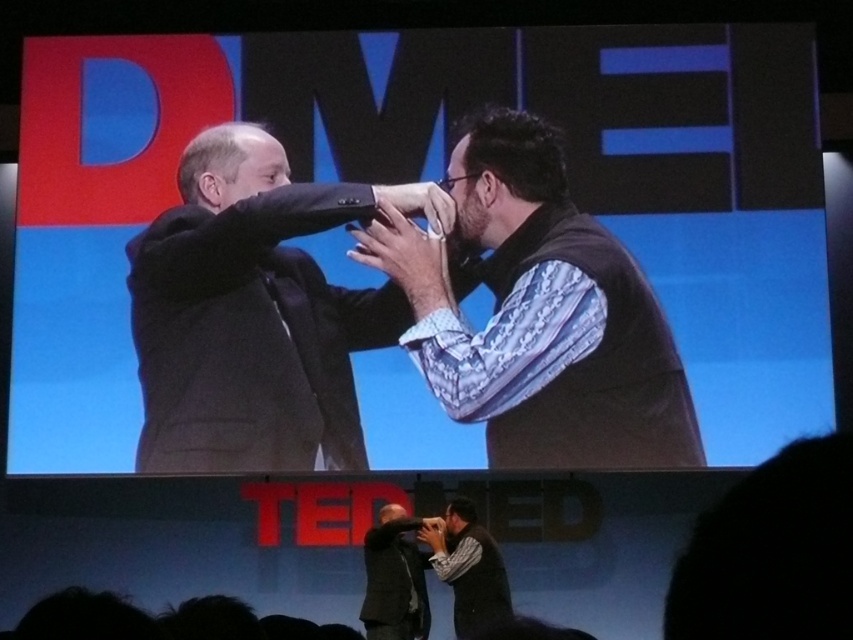
You are standing at the center of the stage where the TED logo is displayed. You need to locate the black suit at left. In which direction should you look relative to your position?

The black suit at left is located at point 0.489 on the x axis and 0.300 on the y axis. Since you are at the center of the stage, you should look to the left side to find the black suit at left.

You are sitting in the audience at this TEDx event and notice two points marked on the stage. The first point is at coordinates point (548, 164) and the second is at point (410, 628). Which point is closer to you?

Point (548, 164) is closer to the viewer than point (410, 628).

In the scene shown: You are an event photographer at the TEDx event. You want to take a photo of the two men on stage. However, you notice that one of the men is partially blocking the other. Which man is closer to the camera, the patterned shirt at center or the dark gray suit at center?

The patterned shirt at center is in front of the dark gray suit at center, so the patterned shirt at center is closer to the camera.